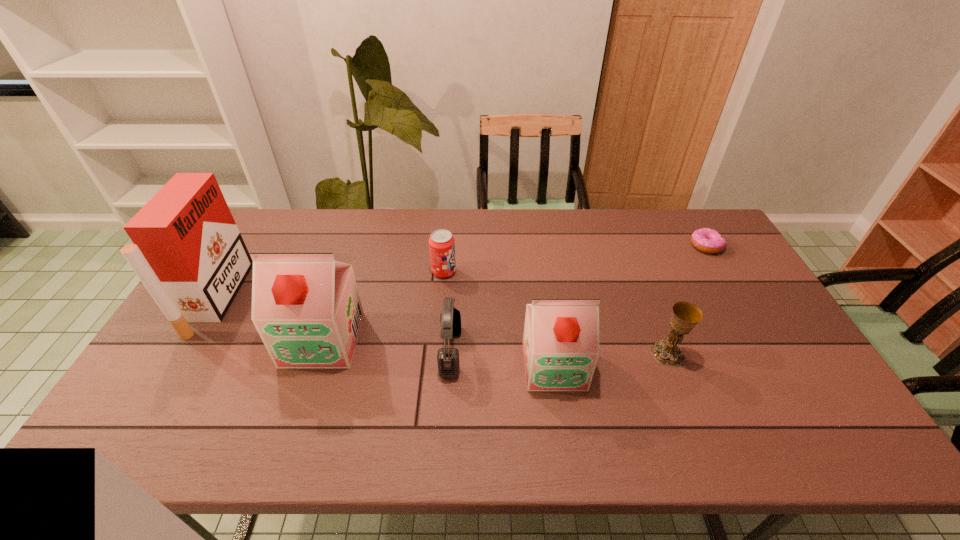
Please point a spot to add another soya milk on the right. Please provide its 2D coordinates. Your answer should be formatted as a tuple, i.e. [(x, y)], where the tuple contains the x and y coordinates of a point satisfying the conditions above.

[(812, 395)]